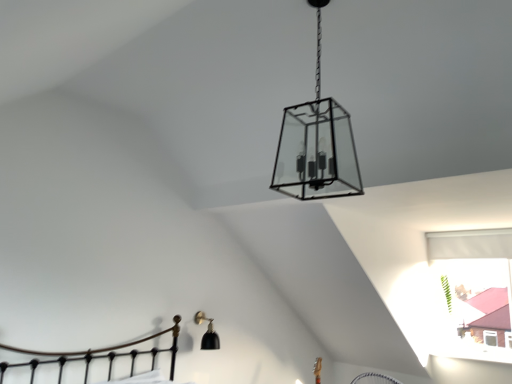
What are the coordinates of `clear glass lantern at center, the 1th lamp positioned from the right` in the screenshot? It's located at (316, 145).

What do you see at coordinates (316, 145) in the screenshot?
I see `clear glass lantern at center, arranged as the 2th lamp when viewed from the left` at bounding box center [316, 145].

The image size is (512, 384). What do you see at coordinates (207, 333) in the screenshot?
I see `black matte wall sconce at lower left, the 2th lamp positioned from the top` at bounding box center [207, 333].

Locate an element on the screen. The height and width of the screenshot is (384, 512). black matte wall sconce at lower left, which is the 1th lamp in bottom-to-top order is located at coordinates pyautogui.click(x=207, y=333).

Locate an element on the screen. Image resolution: width=512 pixels, height=384 pixels. clear glass lantern at center, placed as the 2th lamp when sorted from bottom to top is located at coordinates (316, 145).

Does black matte wall sconce at lower left, which is the first lamp from back to front, appear on the right side of clear glass lantern at center, arranged as the 2th lamp when viewed from the left?

Incorrect, black matte wall sconce at lower left, which is the first lamp from back to front, is not on the right side of clear glass lantern at center, arranged as the 2th lamp when viewed from the left.

Is the position of black matte wall sconce at lower left, which appears as the 1th lamp when viewed from the left, less distant than that of clear glass lantern at center, which appears as the 1th lamp when viewed from the front?

No, it is behind clear glass lantern at center, which appears as the 1th lamp when viewed from the front.

Does point (211, 343) appear closer or farther from the camera than point (311, 118)?

Point (211, 343) is positioned farther from the camera compared to point (311, 118).

From the image's perspective, does black matte wall sconce at lower left, which appears as the 1th lamp when viewed from the left, appear higher than clear glass lantern at center, acting as the 2th lamp starting from the back?

No, from the image's perspective, black matte wall sconce at lower left, which appears as the 1th lamp when viewed from the left, is not above clear glass lantern at center, acting as the 2th lamp starting from the back.

From a real-world perspective, relative to clear glass lantern at center, placed as the 2th lamp when sorted from bottom to top, is black matte wall sconce at lower left, which is the first lamp from back to front, vertically above or below?

In terms of real-world spatial position, black matte wall sconce at lower left, which is the first lamp from back to front, is below clear glass lantern at center, placed as the 2th lamp when sorted from bottom to top.

Which of these two, black matte wall sconce at lower left, which is the first lamp from back to front, or clear glass lantern at center, which appears as the 1th lamp when viewed from the front, is wider?

With larger width is clear glass lantern at center, which appears as the 1th lamp when viewed from the front.

Does black matte wall sconce at lower left, the 2th lamp positioned from the top, have a lesser height compared to clear glass lantern at center, the 1th lamp positioned from the right?

Correct, black matte wall sconce at lower left, the 2th lamp positioned from the top, is not as tall as clear glass lantern at center, the 1th lamp positioned from the right.

Looking at the image, does black matte wall sconce at lower left, the 2th lamp positioned from the top, seem bigger or smaller compared to clear glass lantern at center, the 1th lamp in the top-to-bottom sequence?

black matte wall sconce at lower left, the 2th lamp positioned from the top, is smaller than clear glass lantern at center, the 1th lamp in the top-to-bottom sequence.

Can we say black matte wall sconce at lower left, placed as the second lamp when sorted from right to left, lies outside clear glass lantern at center, the 1th lamp positioned from the right?

Yes, black matte wall sconce at lower left, placed as the second lamp when sorted from right to left, is not within clear glass lantern at center, the 1th lamp positioned from the right.

Is black matte wall sconce at lower left, which appears as the 1th lamp when viewed from the left, far away from clear glass lantern at center, placed as the 2th lamp when sorted from bottom to top?

Yes, black matte wall sconce at lower left, which appears as the 1th lamp when viewed from the left, and clear glass lantern at center, placed as the 2th lamp when sorted from bottom to top, are located far from each other.

Is black matte wall sconce at lower left, which is the first lamp from back to front, looking in the opposite direction of clear glass lantern at center, acting as the 2th lamp starting from the back?

black matte wall sconce at lower left, which is the first lamp from back to front, does not have its back to clear glass lantern at center, acting as the 2th lamp starting from the back.

Can you tell me how much black matte wall sconce at lower left, placed as the second lamp when sorted from right to left, and clear glass lantern at center, placed as the 2th lamp when sorted from bottom to top, differ in facing direction?

There is a 0.00017-degree angle between the facing directions of black matte wall sconce at lower left, placed as the second lamp when sorted from right to left, and clear glass lantern at center, placed as the 2th lamp when sorted from bottom to top.

Could you measure the distance between black matte wall sconce at lower left, placed as the second lamp when sorted from right to left, and clear glass lantern at center, the 1th lamp positioned from the right?

black matte wall sconce at lower left, placed as the second lamp when sorted from right to left, and clear glass lantern at center, the 1th lamp positioned from the right, are 2.19 meters apart.

Identify the location of lamp in front of the black matte wall sconce at lower left, which is the first lamp from back to front. (316, 145).

Visually, is clear glass lantern at center, the 1th lamp positioned from the right, positioned to the left or to the right of black matte wall sconce at lower left, placed as the second lamp when sorted from right to left?

clear glass lantern at center, the 1th lamp positioned from the right, is positioned on black matte wall sconce at lower left, placed as the second lamp when sorted from right to left,'s right side.

Considering the relative positions of clear glass lantern at center, which appears as the 1th lamp when viewed from the front, and black matte wall sconce at lower left, which is the first lamp from back to front, in the image provided, is clear glass lantern at center, which appears as the 1th lamp when viewed from the front, in front of black matte wall sconce at lower left, which is the first lamp from back to front,?

Yes, it is in front of black matte wall sconce at lower left, which is the first lamp from back to front.

Does point (282, 144) come in front of point (208, 342)?

Yes, it is.

From the image's perspective, which one is positioned lower, clear glass lantern at center, acting as the 2th lamp starting from the back, or black matte wall sconce at lower left, marked as the second lamp in a front-to-back arrangement?

black matte wall sconce at lower left, marked as the second lamp in a front-to-back arrangement, from the image's perspective.

From a real-world perspective, between clear glass lantern at center, the 1th lamp positioned from the right, and black matte wall sconce at lower left, which is the first lamp from back to front, who is vertically lower?

From a 3D spatial view, black matte wall sconce at lower left, which is the first lamp from back to front, is below.

Considering the relative sizes of clear glass lantern at center, the 1th lamp in the top-to-bottom sequence, and black matte wall sconce at lower left, placed as the second lamp when sorted from right to left, in the image provided, is clear glass lantern at center, the 1th lamp in the top-to-bottom sequence, thinner than black matte wall sconce at lower left, placed as the second lamp when sorted from right to left,?

Incorrect, the width of clear glass lantern at center, the 1th lamp in the top-to-bottom sequence, is not less than that of black matte wall sconce at lower left, placed as the second lamp when sorted from right to left.

Considering the sizes of clear glass lantern at center, the 1th lamp in the top-to-bottom sequence, and black matte wall sconce at lower left, which is the 1th lamp in bottom-to-top order, in the image, is clear glass lantern at center, the 1th lamp in the top-to-bottom sequence, taller or shorter than black matte wall sconce at lower left, which is the 1th lamp in bottom-to-top order,?

Clearly, clear glass lantern at center, the 1th lamp in the top-to-bottom sequence, is taller compared to black matte wall sconce at lower left, which is the 1th lamp in bottom-to-top order.

Considering the sizes of objects clear glass lantern at center, placed as the 2th lamp when sorted from bottom to top, and black matte wall sconce at lower left, marked as the second lamp in a front-to-back arrangement, in the image provided, who is smaller, clear glass lantern at center, placed as the 2th lamp when sorted from bottom to top, or black matte wall sconce at lower left, marked as the second lamp in a front-to-back arrangement,?

black matte wall sconce at lower left, marked as the second lamp in a front-to-back arrangement, is smaller.

Is clear glass lantern at center, acting as the 2th lamp starting from the back, positioned beyond the bounds of black matte wall sconce at lower left, marked as the second lamp in a front-to-back arrangement?

clear glass lantern at center, acting as the 2th lamp starting from the back, lies outside black matte wall sconce at lower left, marked as the second lamp in a front-to-back arrangement,'s area.

Would you consider clear glass lantern at center, acting as the 2th lamp starting from the back, to be distant from black matte wall sconce at lower left, marked as the second lamp in a front-to-back arrangement?

Indeed, clear glass lantern at center, acting as the 2th lamp starting from the back, is not near black matte wall sconce at lower left, marked as the second lamp in a front-to-back arrangement.

Does clear glass lantern at center, the 1th lamp in the top-to-bottom sequence, turn towards black matte wall sconce at lower left, which is the first lamp from back to front?

No, clear glass lantern at center, the 1th lamp in the top-to-bottom sequence, is not aimed at black matte wall sconce at lower left, which is the first lamp from back to front.

In the scene shown: How many degrees apart are the facing directions of clear glass lantern at center, acting as the 2th lamp starting from the back, and black matte wall sconce at lower left, which appears as the 1th lamp when viewed from the left?

They differ by 0.00017 degrees in their facing directions.

Identify the location of lamp lying in front of the black matte wall sconce at lower left, the 2th lamp positioned from the top. (316, 145).

Where is `lamp on the right of black matte wall sconce at lower left, which appears as the 1th lamp when viewed from the left`? lamp on the right of black matte wall sconce at lower left, which appears as the 1th lamp when viewed from the left is located at coordinates (316, 145).

The height and width of the screenshot is (384, 512). What are the coordinates of `lamp that appears in front of the black matte wall sconce at lower left, the 2th lamp positioned from the top` in the screenshot? It's located at (316, 145).